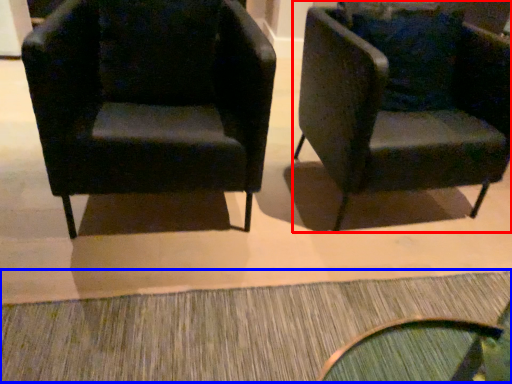
Question: Which object is closer to the camera taking this photo, chair (highlighted by a red box) or doormat (highlighted by a blue box)?

Choices:
 (A) chair
 (B) doormat

Answer: (B)